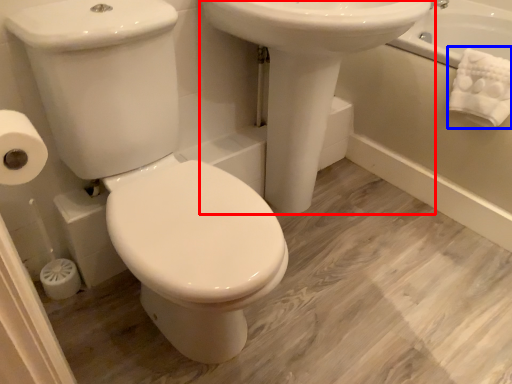
Question: Among these objects, which one is farthest to the camera, sink (highlighted by a red box) or bath towel (highlighted by a blue box)?

Choices:
 (A) sink
 (B) bath towel

Answer: (B)